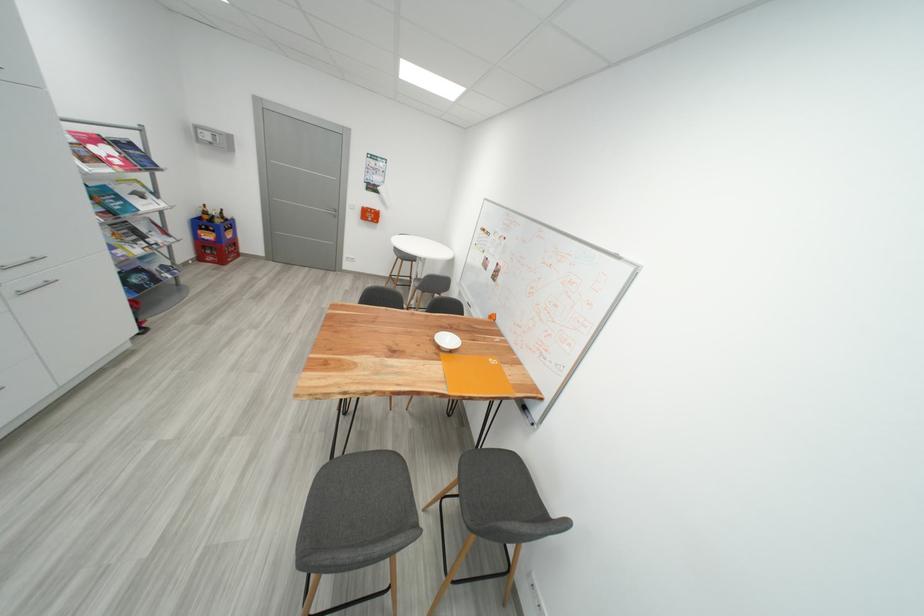
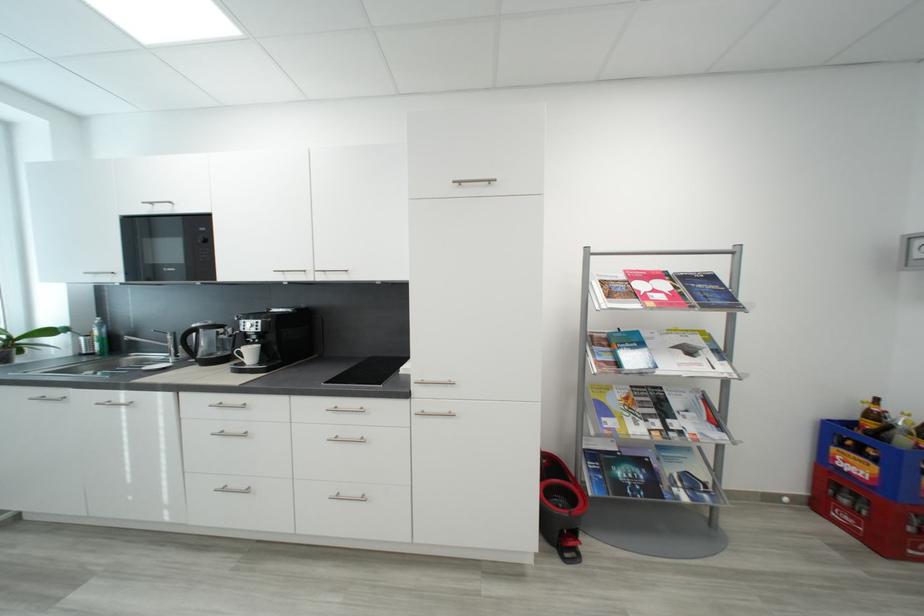
The point at (x=214, y=232) is marked in the first image. Where is the corresponding point in the second image?

(867, 454)